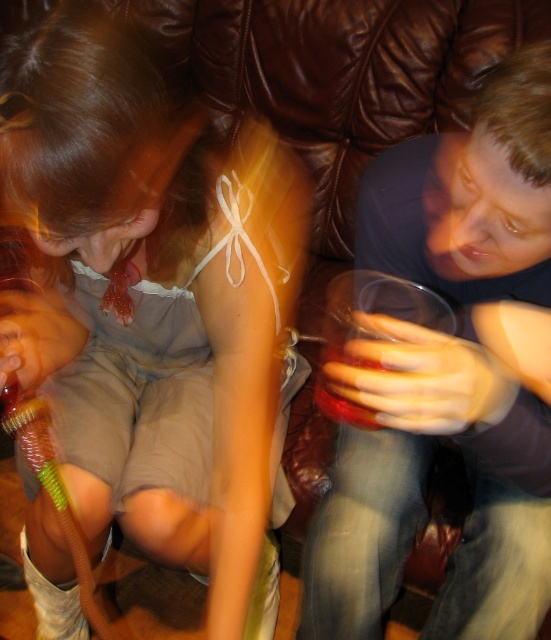
Question: Among these points, which one is farthest from the camera?

Choices:
 (A) (368, 365)
 (B) (278, 314)
 (C) (338, 493)

Answer: (C)

Question: Which object appears farthest from the camera in this image?

Choices:
 (A) matte white ribbon at upper center
 (B) translucent plastic cup at lower center

Answer: (B)

Question: Does matte white ribbon at upper center appear on the left side of translucent plastic cup at lower center?

Choices:
 (A) yes
 (B) no

Answer: (A)

Question: Does matte white ribbon at upper center have a larger size compared to matte plastic cup at right?

Choices:
 (A) no
 (B) yes

Answer: (B)

Question: Which point is farther to the camera?

Choices:
 (A) matte white ribbon at upper center
 (B) translucent plastic cup at lower center
 (C) matte plastic cup at right

Answer: (B)

Question: Can you confirm if matte white ribbon at upper center is positioned above matte plastic cup at right?

Choices:
 (A) yes
 (B) no

Answer: (A)